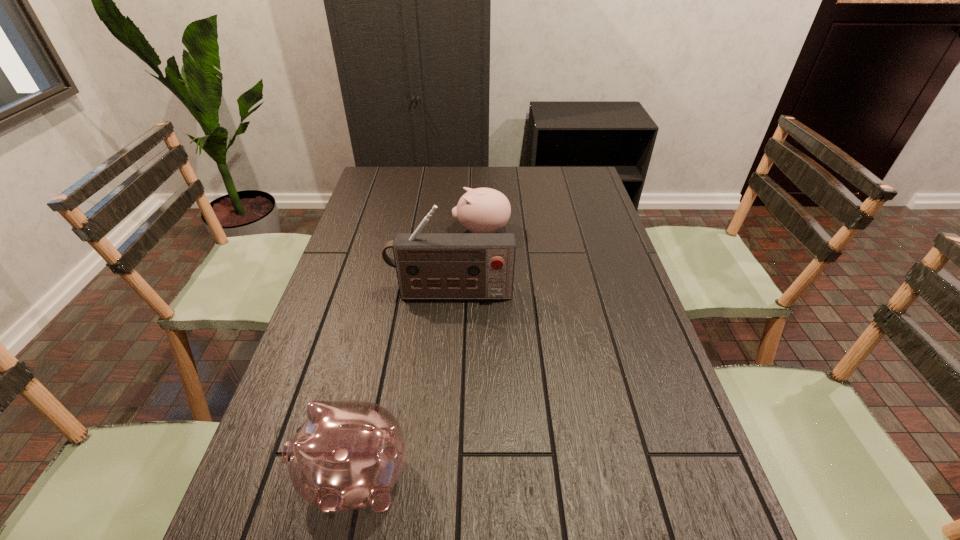
Where is `free space located at the snout of the farther piggy bank`? free space located at the snout of the farther piggy bank is located at coordinates (354, 231).

Identify the location of vacant space located 0.310m at the snout of the farther piggy bank. The height and width of the screenshot is (540, 960). (363, 231).

Locate an element on the screen. This screenshot has height=540, width=960. object positioned at the left edge is located at coordinates pos(348,455).

Locate an element on the screen. The image size is (960, 540). vacant area at the far edge is located at coordinates (505, 188).

Identify the location of vacant region at the left edge of the desktop. (395, 200).

Where is `vacant space at the right edge of the desktop`? This screenshot has height=540, width=960. vacant space at the right edge of the desktop is located at coordinates (681, 479).

Where is `free region at the far left corner of the desktop`? Image resolution: width=960 pixels, height=540 pixels. free region at the far left corner of the desktop is located at coordinates tap(384, 190).

Locate an element on the screen. The height and width of the screenshot is (540, 960). vacant area that lies between the farthest object and the nearest object is located at coordinates (419, 354).

The width and height of the screenshot is (960, 540). Identify the location of free space between the second tallest object and the shortest object. click(419, 354).

Identify the location of vacant space in between the tallest object and the nearer piggy bank. This screenshot has height=540, width=960. [403, 386].